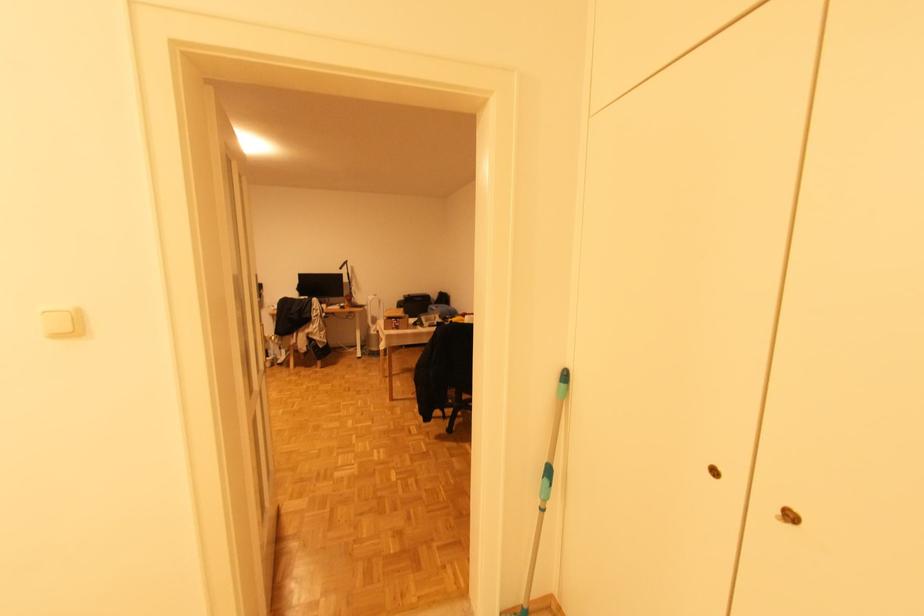
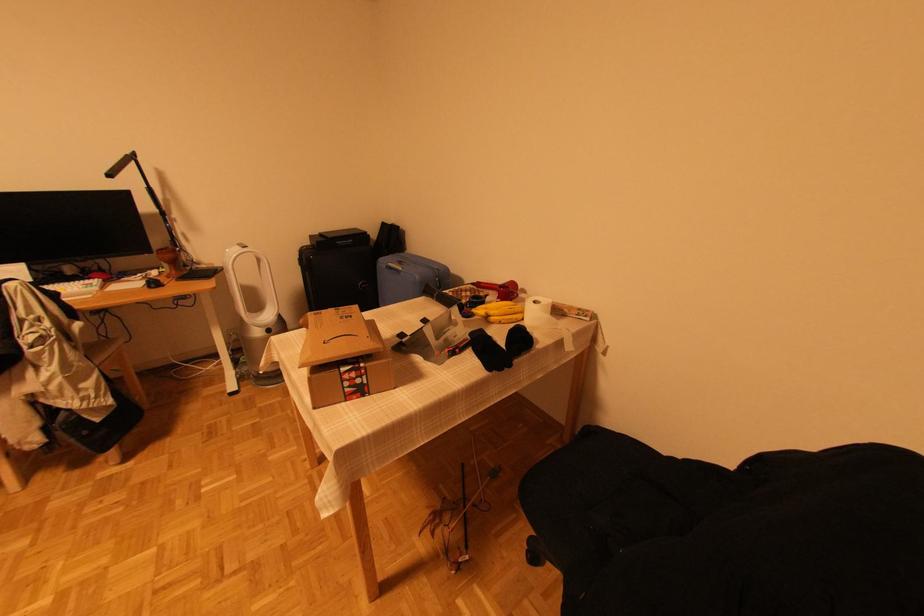
Find the pixel in the second image that matches (398,322) in the first image.

(356, 376)